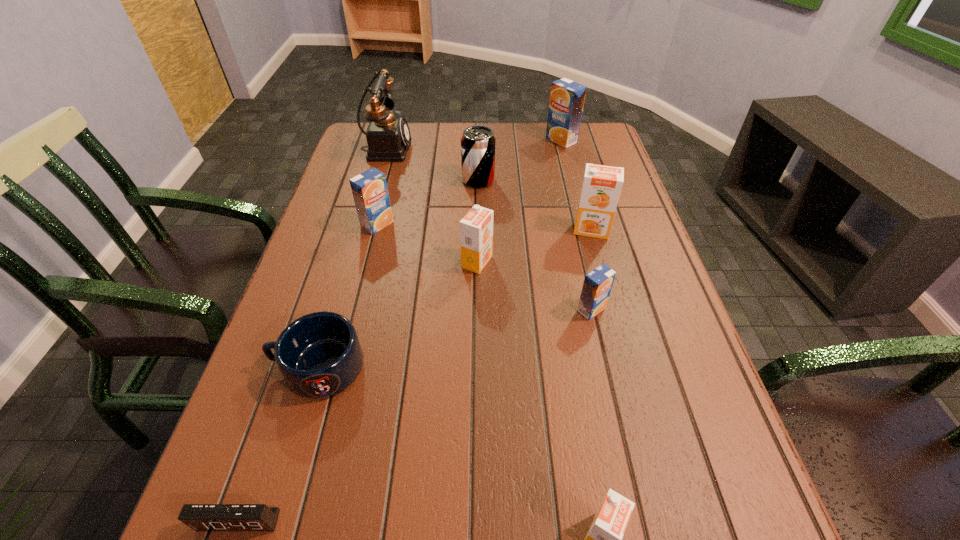
Where is `the fourth farthest orange juice`? Image resolution: width=960 pixels, height=540 pixels. the fourth farthest orange juice is located at coordinates (476, 228).

Locate an element on the screen. The image size is (960, 540). the smallest blue orange_juice is located at coordinates (598, 283).

You are a GUI agent. You are given a task and a screenshot of the screen. Output one action in this format:
    pyautogui.click(x=<x>, y=<y>)
    Task: Click on the second nearest orange juice
    This screenshot has width=960, height=540.
    Given the screenshot: What is the action you would take?
    pyautogui.click(x=598, y=283)

Where is `mug`? mug is located at coordinates click(319, 355).

Image resolution: width=960 pixels, height=540 pixels. Find the location of `the third nearest object`. the third nearest object is located at coordinates (319, 355).

Where is `the shortest object`? This screenshot has height=540, width=960. the shortest object is located at coordinates (200, 517).

I want to click on free spot located on the front of the gray telephone at the rotary dial, so click(522, 146).

At what (x,y) coordinates should I click in order to perform the action: click on vacant space located on the front of the biggest blue orange_juice. Please return your answer as a coordinate pair (x, y). This screenshot has width=960, height=540. Looking at the image, I should click on (569, 171).

You are a GUI agent. You are given a task and a screenshot of the screen. Output one action in this format:
    pyautogui.click(x=<x>, y=<y>)
    Task: Click on the free region located on the right of the rightmost orange orange juice
    This screenshot has height=540, width=960.
    Given the screenshot: What is the action you would take?
    pyautogui.click(x=638, y=230)

The image size is (960, 540). Find the location of `free point located on the right of the eighth nearest object`. free point located on the right of the eighth nearest object is located at coordinates (512, 180).